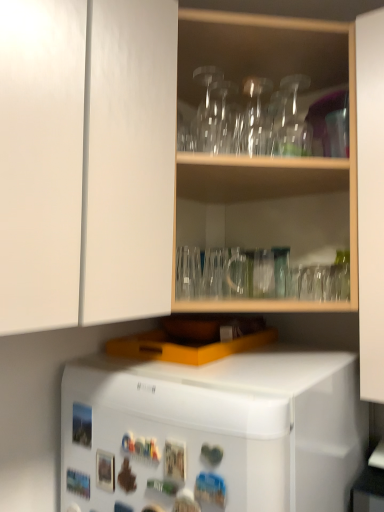
Question: Could you tell me if transparent glass vase at upper center, which appears as the 1th glass vase when viewed from the left, is turned towards transparent glassware at upper center?

Choices:
 (A) no
 (B) yes

Answer: (B)

Question: Considering the relative positions of transparent glass vase at upper center, which appears as the 1th glass vase when viewed from the left, and transparent glassware at upper center in the image provided, is transparent glass vase at upper center, which appears as the 1th glass vase when viewed from the left, to the right of transparent glassware at upper center from the viewer's perspective?

Choices:
 (A) no
 (B) yes

Answer: (A)

Question: Is transparent glass vase at upper center, the second glass vase positioned from the front, shorter than transparent glassware at upper center?

Choices:
 (A) no
 (B) yes

Answer: (B)

Question: Does transparent glass vase at upper center, which is the 2th glass vase from right to left, have a greater width compared to transparent glassware at upper center?

Choices:
 (A) yes
 (B) no

Answer: (B)

Question: Does transparent glass vase at upper center, which ranks as the first glass vase in back-to-front order, contain transparent glassware at upper center?

Choices:
 (A) yes
 (B) no

Answer: (B)

Question: From a real-world perspective, is white matte refrigerator at lower center physically located above or below transparent glassware at upper center?

Choices:
 (A) above
 (B) below

Answer: (B)

Question: Is white matte refrigerator at lower center taller or shorter than transparent glassware at upper center?

Choices:
 (A) short
 (B) tall

Answer: (A)

Question: Choose the correct answer: Is white matte refrigerator at lower center inside transparent glassware at upper center or outside it?

Choices:
 (A) inside
 (B) outside

Answer: (B)

Question: From the image's perspective, is white matte refrigerator at lower center positioned above or below transparent glassware at upper center?

Choices:
 (A) above
 (B) below

Answer: (B)

Question: Is transparent glassware at upper center wider or thinner than transparent glass vase at upper center, which ranks as the 1th glass vase in front-to-back order?

Choices:
 (A) thin
 (B) wide

Answer: (B)

Question: Is transparent glassware at upper center inside the boundaries of transparent glass vase at upper center, which ranks as the 1th glass vase in front-to-back order, or outside?

Choices:
 (A) inside
 (B) outside

Answer: (B)

Question: Is transparent glassware at upper center to the left or to the right of transparent glass vase at upper center, arranged as the second glass vase when viewed from the back, in the image?

Choices:
 (A) left
 (B) right

Answer: (A)

Question: From the image's perspective, relative to transparent glass vase at upper center, positioned as the second glass vase in left-to-right order, is transparent glassware at upper center above or below?

Choices:
 (A) above
 (B) below

Answer: (B)

Question: From a real-world perspective, relative to white matte cabinet doors at upper left, is white matte refrigerator at lower center vertically above or below?

Choices:
 (A) above
 (B) below

Answer: (B)

Question: Is point (301, 488) closer or farther from the camera than point (71, 175)?

Choices:
 (A) farther
 (B) closer

Answer: (A)